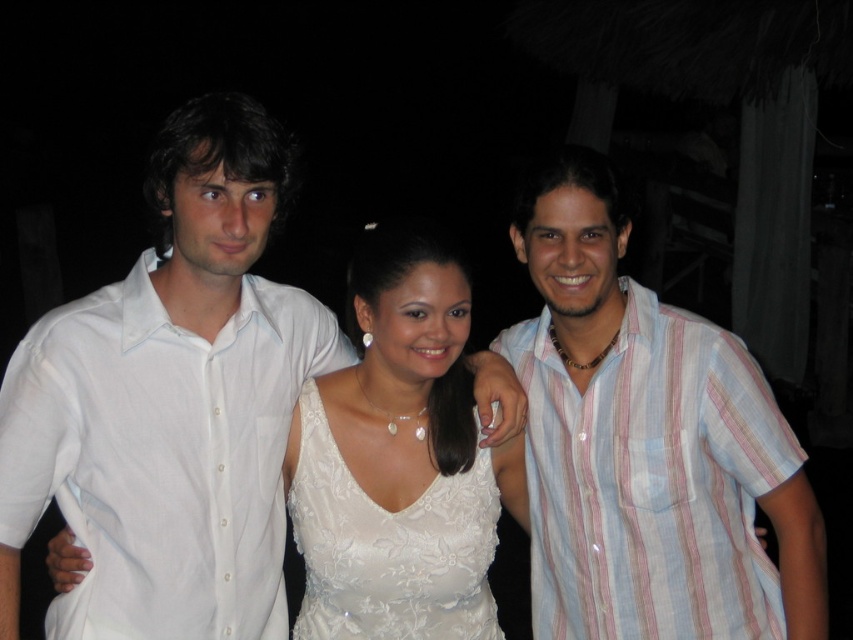
Question: Is white cotton shirt at left wider than light blue striped shirt at right?

Choices:
 (A) yes
 (B) no

Answer: (A)

Question: Which of the following is the farthest from the observer?

Choices:
 (A) light blue striped shirt at right
 (B) white lace dress at center
 (C) white cotton shirt at left

Answer: (B)

Question: Which point is farther to the camera?

Choices:
 (A) (676, 364)
 (B) (358, 554)

Answer: (A)

Question: Is white cotton shirt at left thinner than white lace dress at center?

Choices:
 (A) no
 (B) yes

Answer: (A)

Question: Does white cotton shirt at left appear over white lace dress at center?

Choices:
 (A) yes
 (B) no

Answer: (A)

Question: Based on their relative distances, which object is nearer to the light blue striped shirt at right?

Choices:
 (A) white cotton shirt at left
 (B) white lace dress at center

Answer: (B)